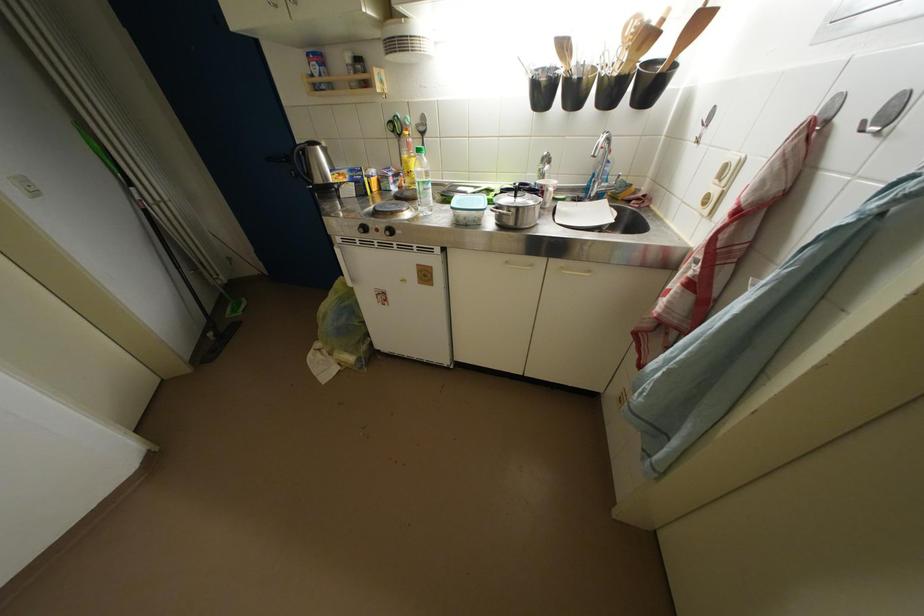
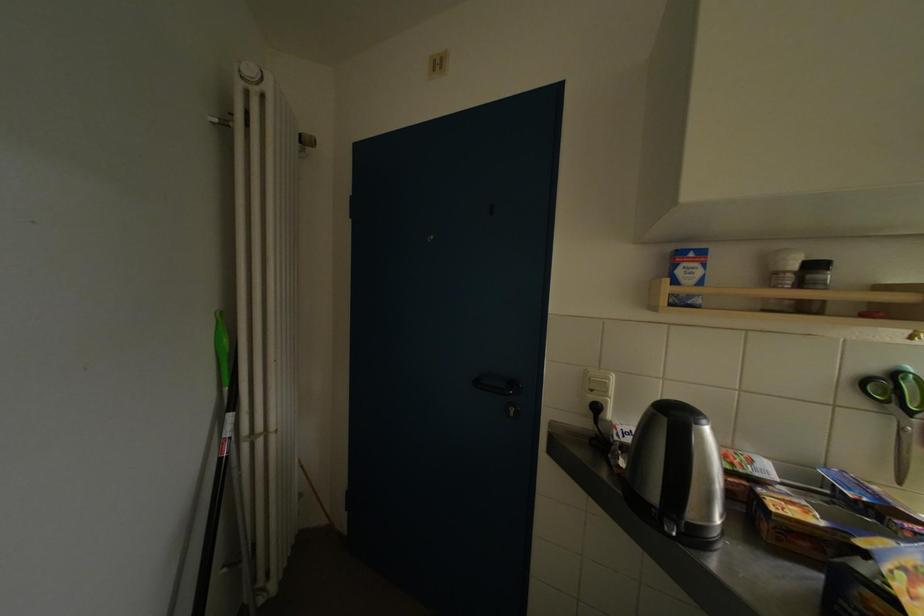
In the second image, find the point that corresponds to pixel 363 63 in the first image.

(821, 270)